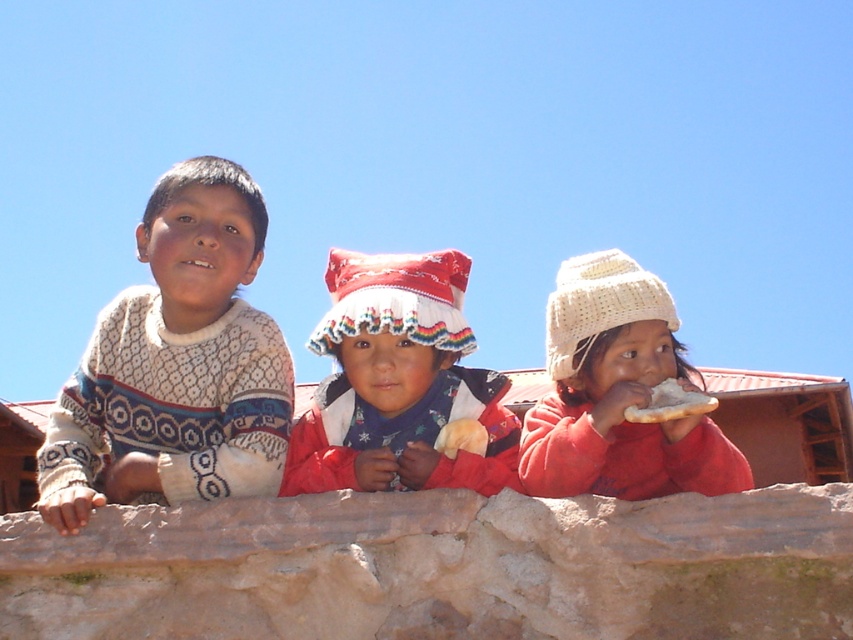
Between red and white knitted hat at center and white knitted hat at upper center, which one has more height?

Standing taller between the two is red and white knitted hat at center.

Which is in front, point (358, 365) or point (689, 419)?

Positioned in front is point (689, 419).

Between point (373, 486) and point (706, 477), which one is positioned in front?

Point (706, 477) is more forward.

You are a GUI agent. You are given a task and a screenshot of the screen. Output one action in this format:
    pyautogui.click(x=<x>, y=<y>)
    Task: Click on the red and white knitted hat at center
    The height and width of the screenshot is (640, 853).
    Given the screenshot: What is the action you would take?
    pyautogui.click(x=398, y=381)

Between white knitted sweater at left and white knitted hat at upper center, which one has more height?

white knitted sweater at left is taller.

How far apart are white knitted sweater at left and white knitted hat at upper center?

The distance of white knitted sweater at left from white knitted hat at upper center is 39.73 feet.

Image resolution: width=853 pixels, height=640 pixels. Describe the element at coordinates (177, 364) in the screenshot. I see `white knitted sweater at left` at that location.

At what (x,y) coordinates should I click in order to perform the action: click on white knitted sweater at left. Please return your answer as a coordinate pair (x, y). The width and height of the screenshot is (853, 640). Looking at the image, I should click on (177, 364).

Is brown rough stone at center to the left of white knitted sweater at left from the viewer's perspective?

In fact, brown rough stone at center is to the right of white knitted sweater at left.

Does brown rough stone at center appear under white knitted sweater at left?

Indeed, brown rough stone at center is positioned under white knitted sweater at left.

The image size is (853, 640). I want to click on brown rough stone at center, so pos(440,566).